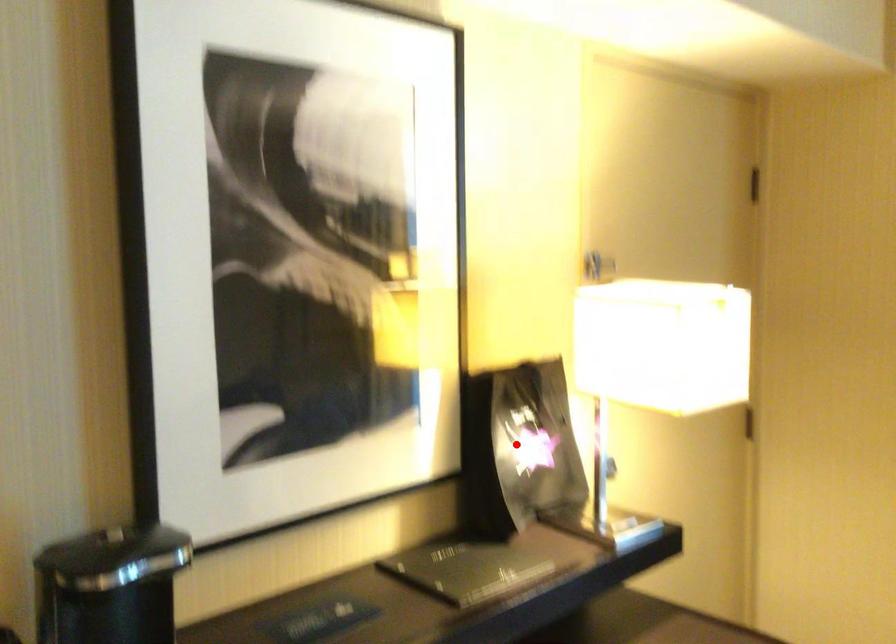
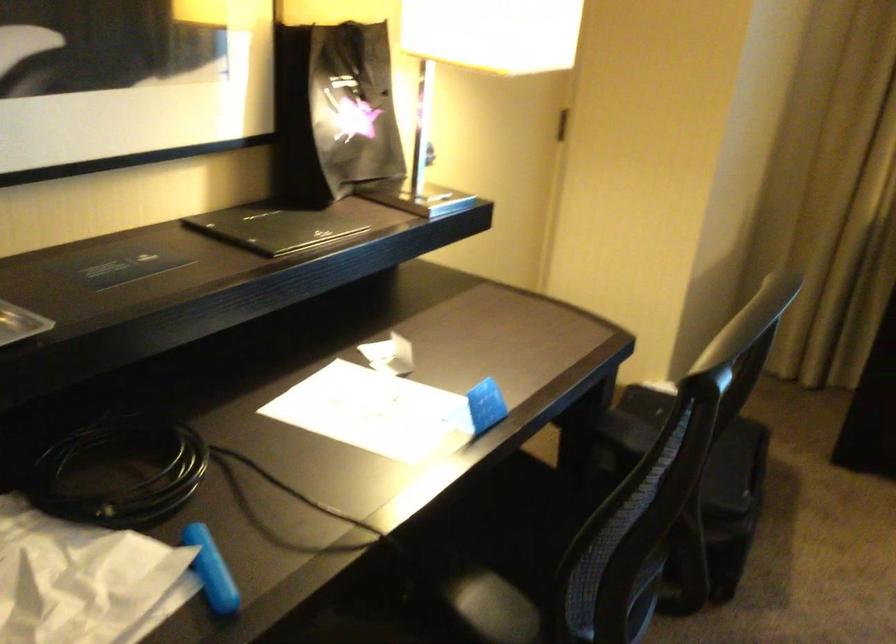
Find the pixel in the second image that matches the highlighted location in the first image.

(334, 111)